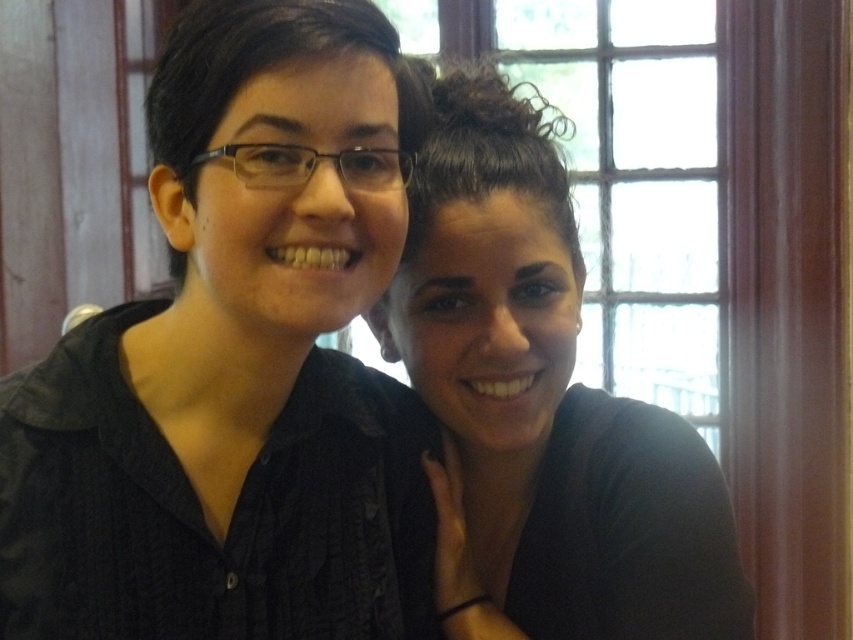
You are trying to decide which black shirt to wear for an event. You see both the black matte shirt at center and the matte black shirt at center in the image. Which one is bigger?

The black matte shirt at center is larger in size compared to the matte black shirt at center, so it would be the bigger one to choose.

You are taking a photo of two people standing indoors. The scene has a window with wooden frames and warm lighting. You notice a point at coordinates (236,364). What object does this point correspond to in the image?

The point at coordinates (236,364) corresponds to the black matte shirt at center.

You are a photographer trying to capture a clear shot of the black matte shirt at center and the matte black shirt at center. Which one will be more visible in your photo?

The black matte shirt at center will be more visible because it is in front of the matte black shirt at center, making it appear closer to the camera.